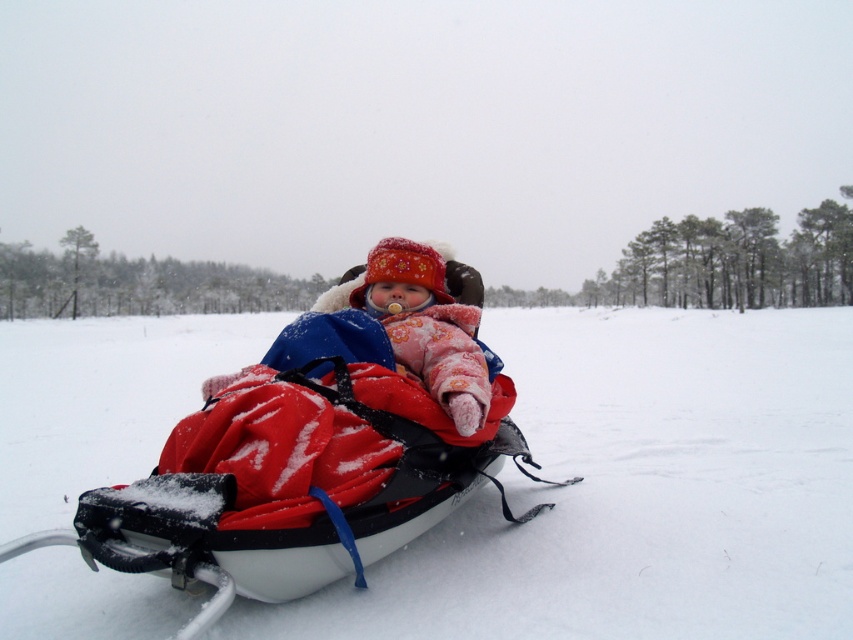
Question: Which of the following is the closest to the observer?

Choices:
 (A) (431, 308)
 (B) (120, 365)

Answer: (A)

Question: Does red fabric snowmobile at center have a smaller size compared to fluffy pink snowsuit at center?

Choices:
 (A) no
 (B) yes

Answer: (A)

Question: Which point is closer to the camera?

Choices:
 (A) (479, 422)
 (B) (189, 614)

Answer: (B)

Question: Is red fabric snowmobile at center positioned at the back of fluffy pink snowsuit at center?

Choices:
 (A) no
 (B) yes

Answer: (A)

Question: Can you confirm if red fabric snowmobile at center is wider than fluffy pink snowsuit at center?

Choices:
 (A) no
 (B) yes

Answer: (B)